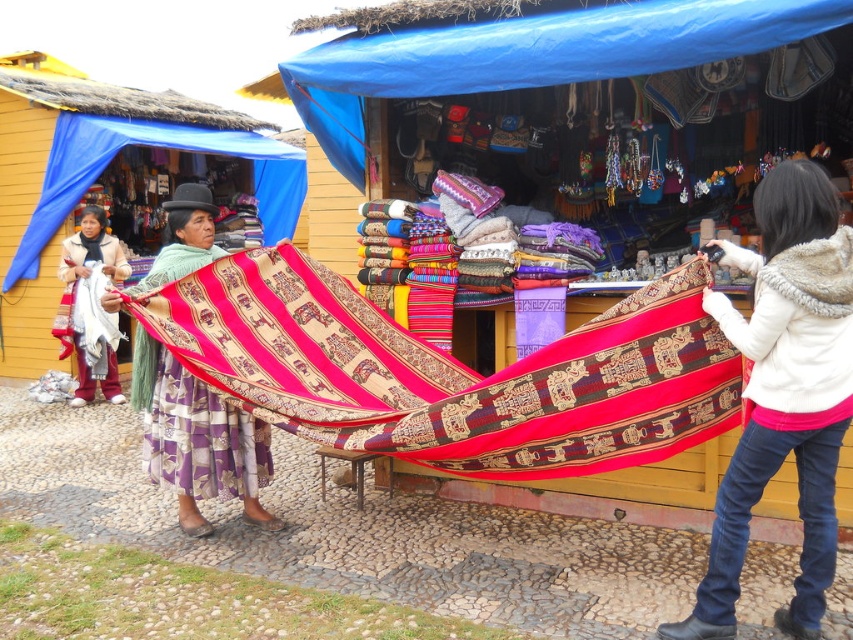
Question: Does textured woolen fabric at center have a greater width compared to white woven textile at center?

Choices:
 (A) no
 (B) yes

Answer: (B)

Question: Does textured woolen fabric at center appear on the right side of white woven textile at center?

Choices:
 (A) no
 (B) yes

Answer: (B)

Question: Which point is farther from the camera taking this photo?

Choices:
 (A) (747, 529)
 (B) (228, 492)

Answer: (B)

Question: Which object is farther from the camera taking this photo?

Choices:
 (A) textured woven blanket at center
 (B) textured woolen fabric at center
 (C) white fur-lined jacket at right
 (D) white woven textile at center

Answer: (D)

Question: Based on their relative distances, which object is farther from the white fur-lined jacket at right?

Choices:
 (A) textured woolen fabric at center
 (B) white woven textile at center

Answer: (B)

Question: From the image, what is the correct spatial relationship of textured woven blanket at center in relation to white fur-lined jacket at right?

Choices:
 (A) below
 (B) above

Answer: (B)